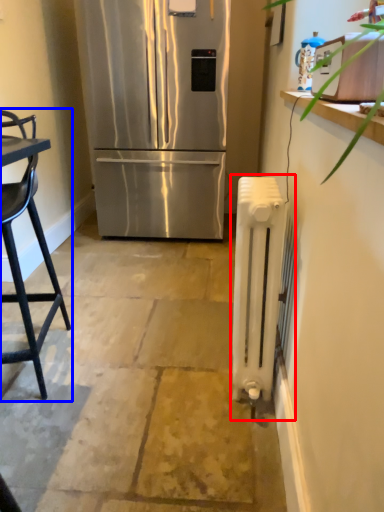
Question: Which of the following is the farthest to the observer, radiator (highlighted by a red box) or chair (highlighted by a blue box)?

Choices:
 (A) radiator
 (B) chair

Answer: (A)